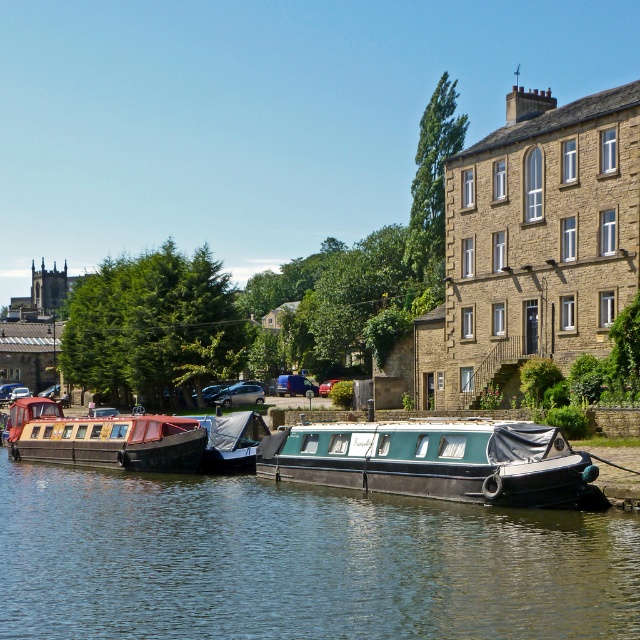
Looking at this image, who is more distant from viewer, (96, 444) or (205, 429)?

The point (96, 444) is behind.

Is point (186, 467) positioned after point (221, 417)?

That is False.

Is point (150, 417) behind point (248, 432)?

Yes, point (150, 417) is farther from viewer.

Image resolution: width=640 pixels, height=640 pixels. In order to click on wooden polished boat at left in this screenshot , I will do `click(104, 438)`.

Does green rubber boat at center have a greater height compared to blue tarpaulin boat at center?

No.

Is green rubber boat at center wider than blue tarpaulin boat at center?

Correct, the width of green rubber boat at center exceeds that of blue tarpaulin boat at center.

What do you see at coordinates (298, 561) in the screenshot? I see `green rubber boat at center` at bounding box center [298, 561].

Identify the location of green rubber boat at center. This screenshot has width=640, height=640. (298, 561).

Can you confirm if green rubber boat at center is positioned to the left of teal matte boat at center?

Yes, green rubber boat at center is to the left of teal matte boat at center.

Does green rubber boat at center have a lesser width compared to teal matte boat at center?

No.

You are a GUI agent. You are given a task and a screenshot of the screen. Output one action in this format:
    pyautogui.click(x=<x>, y=<y>)
    Task: Click on the green rubber boat at center
    The image size is (640, 640).
    Given the screenshot: What is the action you would take?
    pyautogui.click(x=298, y=561)